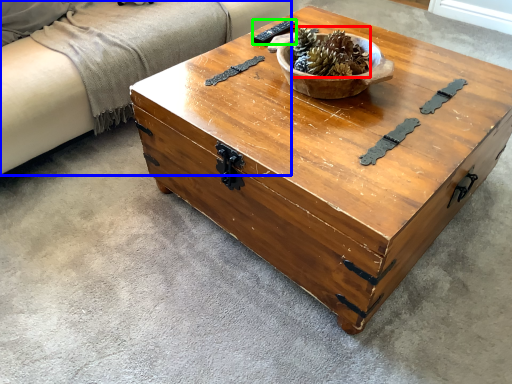
Question: Estimate the real-world distances between objects in this image. Which object is closer to centerpiece (highlighted by a red box), couch (highlighted by a blue box) or remote (highlighted by a green box)?

Choices:
 (A) couch
 (B) remote

Answer: (B)